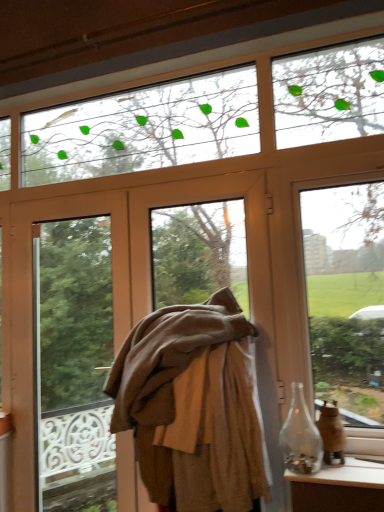
Question: In terms of size, does translucent glass vase at right appear bigger or smaller than brown woolen coat at center?

Choices:
 (A) small
 (B) big

Answer: (A)

Question: From their relative heights in the image, would you say translucent glass vase at right is taller or shorter than brown woolen coat at center?

Choices:
 (A) tall
 (B) short

Answer: (B)

Question: Considering the real-world distances, which object is closest to the transparent glass bottle at lower right?

Choices:
 (A) transparent glass jar at lower right
 (B) translucent glass vase at right
 (C) brown woolen coat at center
 (D) transparent glass window at upper right
 (E) brown fabric at center

Answer: (B)

Question: Which object is positioned closest to the brown fabric at center?

Choices:
 (A) brown woolen coat at center
 (B) translucent glass vase at right
 (C) transparent glass window at upper right
 (D) transparent glass bottle at lower right
 (E) transparent glass jar at lower right

Answer: (A)